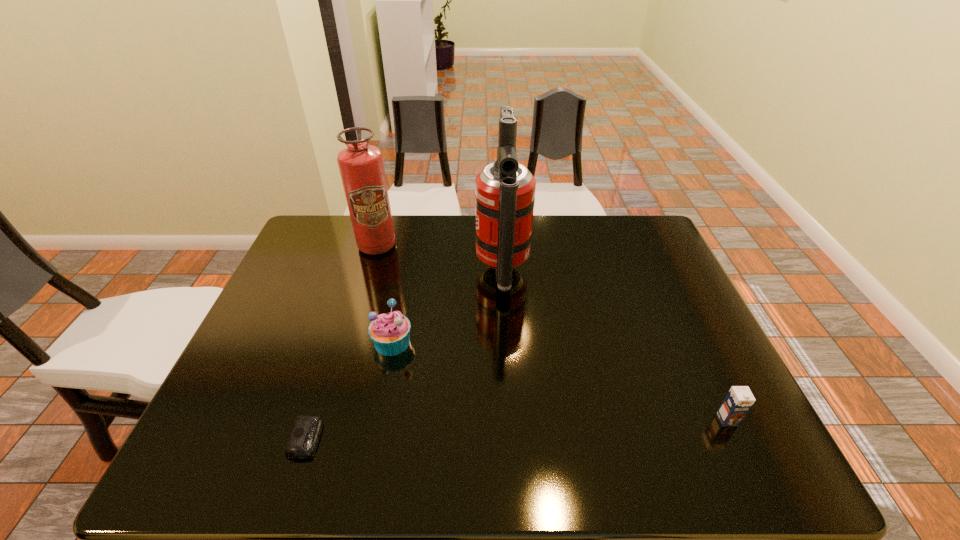
Identify the location of object that can be found as the fourth closest to the shorter fire extinguisher. This screenshot has width=960, height=540. (738, 401).

Where is `object that stands as the fourth closest to the muffin`? object that stands as the fourth closest to the muffin is located at coordinates coord(738,401).

Where is `free space that satisfies the following two spatial constraints: 1. on the front label of the chocolate milk; 2. on the display of the alarm clock`? This screenshot has width=960, height=540. free space that satisfies the following two spatial constraints: 1. on the front label of the chocolate milk; 2. on the display of the alarm clock is located at coordinates tap(736, 438).

Locate an element on the screen. vacant area in the image that satisfies the following two spatial constraints: 1. on the label side of the shorter fire extinguisher; 2. on the display of the shortest object is located at coordinates (321, 438).